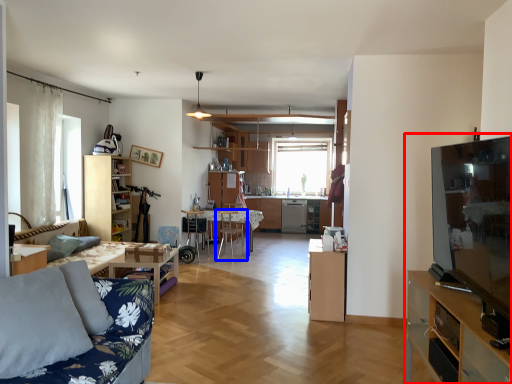
Question: Which object is further to the camera taking this photo, entertainment center (highlighted by a red box) or chair (highlighted by a blue box)?

Choices:
 (A) entertainment center
 (B) chair

Answer: (B)